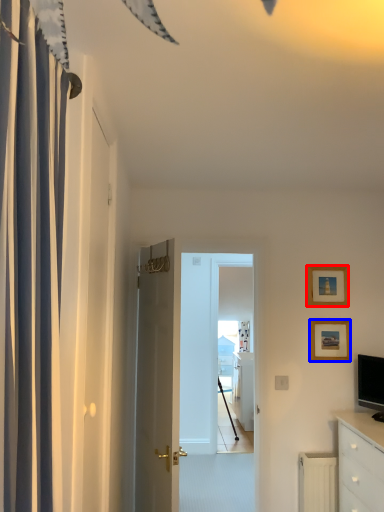
Question: Which point is closer to the camera, picture frame (highlighted by a red box) or picture frame (highlighted by a blue box)?

Choices:
 (A) picture frame
 (B) picture frame

Answer: (B)